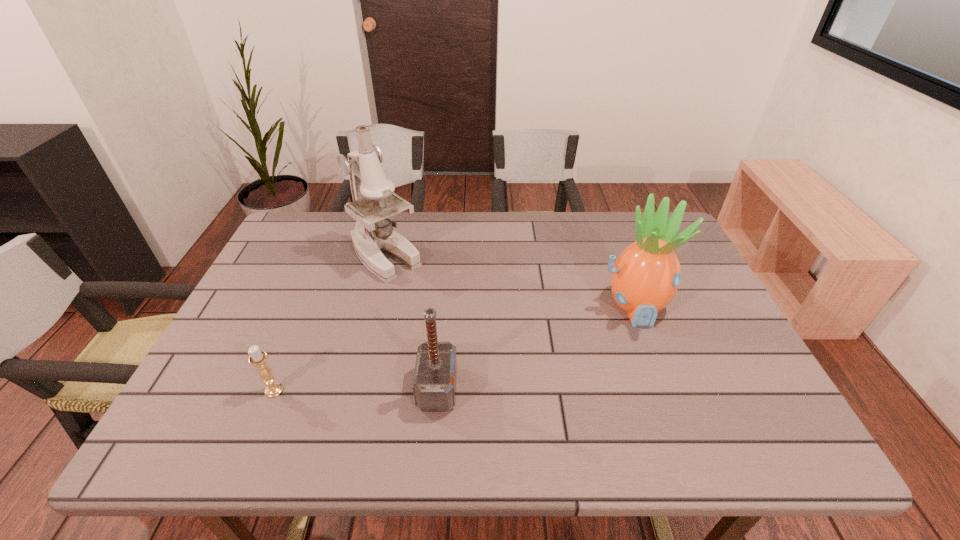
The width and height of the screenshot is (960, 540). Find the location of `the second object from left to right`. the second object from left to right is located at coordinates (373, 233).

Identify the location of microscope. The image size is (960, 540). (373, 233).

Locate an element on the screen. the rightmost object is located at coordinates (645, 277).

Locate an element on the screen. This screenshot has width=960, height=540. the second tallest object is located at coordinates (645, 277).

The width and height of the screenshot is (960, 540). I want to click on the second object from right to left, so click(x=434, y=384).

Where is `the second shortest object`? the second shortest object is located at coordinates (434, 384).

The image size is (960, 540). Identify the location of the shortest object. (258, 358).

Identify the location of the leftmost object. The height and width of the screenshot is (540, 960). (258, 358).

I want to click on vacant space located 0.060m on the right of the second object from left to right, so click(444, 256).

Identify the location of vacant space located 0.190m at the entrance of the third shortest object. The image size is (960, 540). (668, 397).